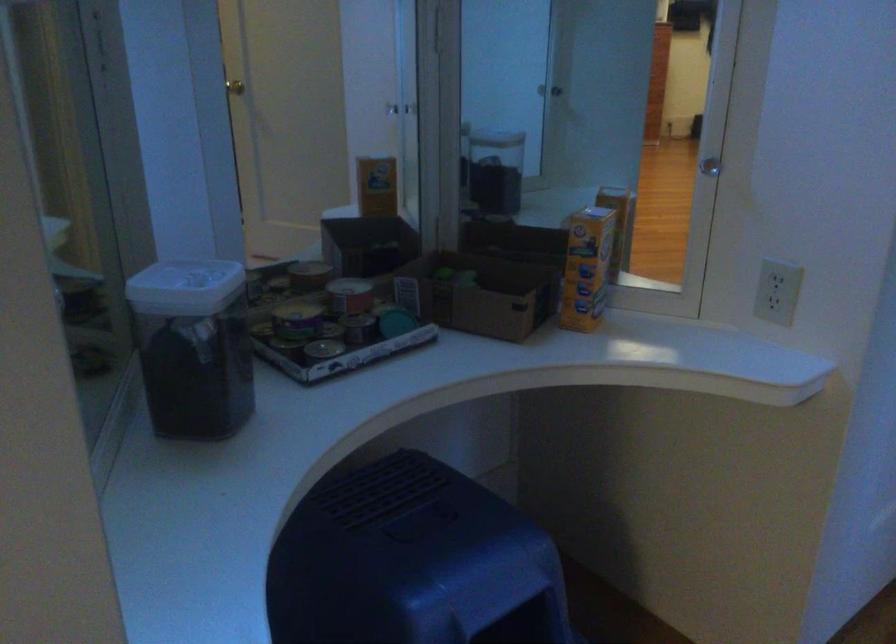
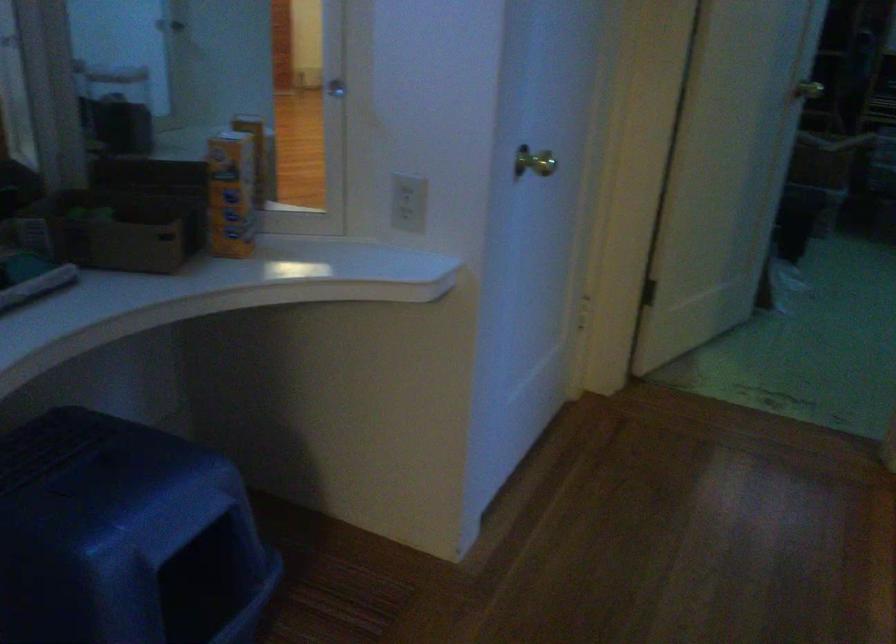
Question: The first image is from the beginning of the video and the second image is from the end. How did the camera likely rotate when shooting the video?

Choices:
 (A) Left
 (B) Right
 (C) Up
 (D) Down

Answer: (B)